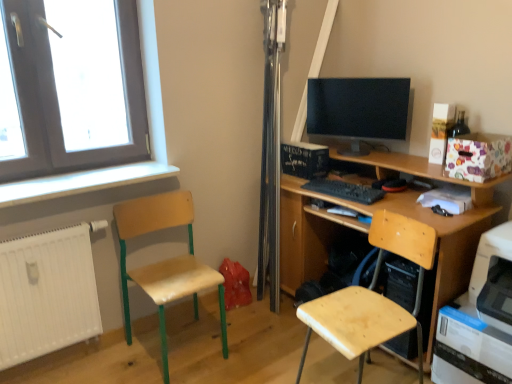
Question: Considering the positions of point (479, 135) and point (158, 193), is point (479, 135) closer or farther from the camera than point (158, 193)?

Choices:
 (A) closer
 (B) farther

Answer: (A)

Question: Is floral paper box at upper right situated inside wooden seat at left, which is the second chair from right to left, or outside?

Choices:
 (A) outside
 (B) inside

Answer: (A)

Question: Which object is the farthest from the floral paper box at upper right?

Choices:
 (A) matte black monitor at center
 (B) wooden desk at center
 (C) white plastic printer at lower right
 (D) wooden seat at left, which is the second chair from right to left
 (E) wooden chair at lower right, which appears as the 2th chair when viewed from the left

Answer: (D)

Question: Which object is the closest to the black matte keyboard at center?

Choices:
 (A) white matte radiator at lower left
 (B) wooden seat at left, which is the second chair from right to left
 (C) white plastic printer at lower right
 (D) wooden chair at lower right, acting as the first chair starting from the right
 (E) white painted wood at left

Answer: (D)